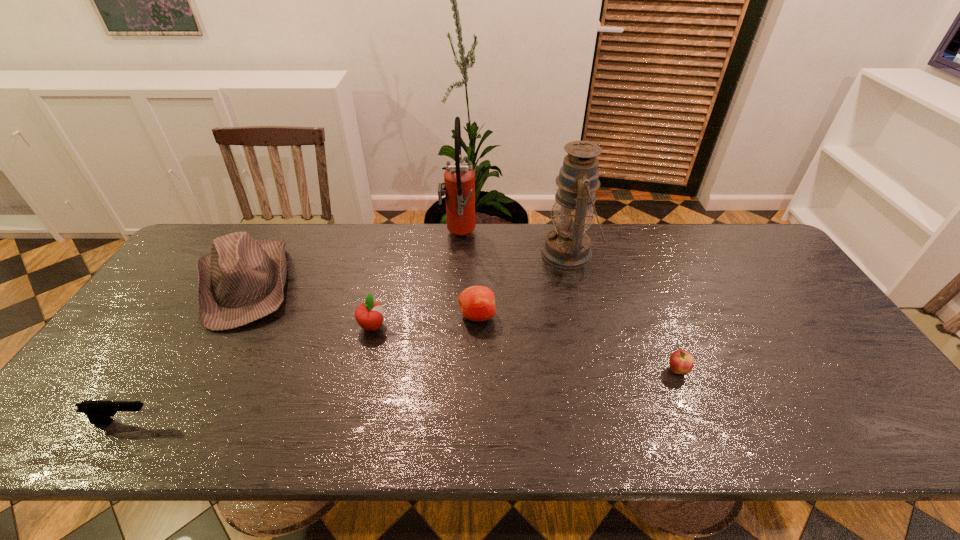
Where is `unoccupied position between the fedora and the second apple from left to right`? unoccupied position between the fedora and the second apple from left to right is located at coordinates point(362,300).

Find the location of a particular element. The image size is (960, 540). vacant area between the fire extinguisher and the second apple from right to left is located at coordinates (468, 276).

The height and width of the screenshot is (540, 960). Identify the location of empty space between the third tallest object and the fire extinguisher. (352, 260).

Locate an element on the screen. free point between the leftmost apple and the fedora is located at coordinates (309, 305).

Image resolution: width=960 pixels, height=540 pixels. In order to click on vacant space that is in between the second apple from right to left and the pistol in this screenshot , I will do `click(300, 369)`.

This screenshot has height=540, width=960. I want to click on unoccupied area between the fifth object from right to left and the fire extinguisher, so click(x=416, y=281).

You are a GUI agent. You are given a task and a screenshot of the screen. Output one action in this format:
    pyautogui.click(x=<x>, y=<y>)
    Task: Click on the vacant space in between the fedora and the third object from left to right
    This screenshot has width=960, height=540.
    Given the screenshot: What is the action you would take?
    pyautogui.click(x=309, y=305)

This screenshot has height=540, width=960. Find the location of `blank region between the nearest apple and the third tallest object`. blank region between the nearest apple and the third tallest object is located at coordinates (462, 327).

Identify which object is located as the third nearest to the nearest apple. Please provide its 2D coordinates. Your answer should be formatted as a tuple, i.e. [(x, y)], where the tuple contains the x and y coordinates of a point satisfying the conditions above.

[(459, 178)]

I want to click on the fifth closest object relative to the leftmost apple, so click(x=567, y=246).